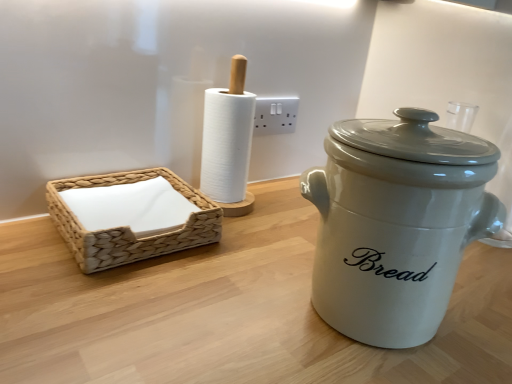
Find the location of a particular element. The width and height of the screenshot is (512, 384). white plastic electric outlet at center is located at coordinates coord(275,114).

Does point (207, 223) lie behind point (378, 184)?

Yes, it is behind point (378, 184).

Consider the image. Considering the sizes of objects woven beige basket at left and white ceramic crock pot at right in the image provided, who is shorter, woven beige basket at left or white ceramic crock pot at right?

Standing shorter between the two is woven beige basket at left.

In the scene shown: Is the position of woven beige basket at left more distant than that of white ceramic crock pot at right?

Yes, it is behind white ceramic crock pot at right.

Considering the sizes of objects woven beige basket at left and white ceramic crock pot at right in the image provided, who is smaller, woven beige basket at left or white ceramic crock pot at right?

With smaller size is woven beige basket at left.

Who is shorter, white ceramic crock pot at right or woven beige basket at left?

woven beige basket at left is shorter.

Considering the positions of objects white ceramic crock pot at right and woven beige basket at left in the image provided, who is more to the right, white ceramic crock pot at right or woven beige basket at left?

From the viewer's perspective, white ceramic crock pot at right appears more on the right side.

Is white ceramic crock pot at right located outside woven beige basket at left?

Absolutely, white ceramic crock pot at right is external to woven beige basket at left.

From a real-world perspective, which is physically below, white ceramic crock pot at right or woven beige basket at left?

In real-world perspective, woven beige basket at left is lower.

From the image's perspective, which one is positioned higher, white plastic electric outlet at center or woven beige basket at left?

white plastic electric outlet at center.

Considering the positions of objects white plastic electric outlet at center and woven beige basket at left in the image provided, who is more to the left, white plastic electric outlet at center or woven beige basket at left?

woven beige basket at left.

From a real-world perspective, is white plastic electric outlet at center physically above woven beige basket at left?

Indeed, from a real-world perspective, white plastic electric outlet at center stands above woven beige basket at left.

Would you say white plastic electric outlet at center is to the left or to the right of white ceramic crock pot at right in the picture?

Clearly, white plastic electric outlet at center is on the left of white ceramic crock pot at right in the image.

Between white plastic electric outlet at center and white ceramic crock pot at right, which one has smaller size?

white plastic electric outlet at center.

Considering the sizes of white plastic electric outlet at center and white ceramic crock pot at right in the image, is white plastic electric outlet at center taller or shorter than white ceramic crock pot at right?

white plastic electric outlet at center is shorter than white ceramic crock pot at right.

Is white ceramic crock pot at right far away from white plastic electric outlet at center?

Actually, white ceramic crock pot at right and white plastic electric outlet at center are a little close together.

Is white ceramic crock pot at right taller than white plastic electric outlet at center?

Yes.

Find the location of a particular element. crock pot that is under the white plastic electric outlet at center (from a real-world perspective) is located at coordinates (397, 223).

Considering the relative positions of white ceramic crock pot at right and white plastic electric outlet at center in the image provided, is white ceramic crock pot at right to the right of white plastic electric outlet at center from the viewer's perspective?

Yes, white ceramic crock pot at right is to the right of white plastic electric outlet at center.

From their relative heights in the image, would you say woven beige basket at left is taller or shorter than white plastic electric outlet at center?

Clearly, woven beige basket at left is shorter compared to white plastic electric outlet at center.

Would you consider woven beige basket at left to be distant from white plastic electric outlet at center?

woven beige basket at left is near white plastic electric outlet at center, not far away.

Is point (66, 188) closer or farther from the camera than point (270, 105)?

Clearly, point (66, 188) is closer to the camera than point (270, 105).

At what (x,y) coordinates should I click in order to perform the action: click on basket above the white ceramic crock pot at right (from the image's perspective). Please return your answer as a coordinate pair (x, y). The width and height of the screenshot is (512, 384). Looking at the image, I should click on click(130, 216).

Identify the location of basket to the left of white ceramic crock pot at right. (130, 216).

Looking at the image, which one is located further to white plastic electric outlet at center, white ceramic crock pot at right or woven beige basket at left?

white ceramic crock pot at right.

Considering their positions, is woven beige basket at left positioned closer to white plastic electric outlet at center than white ceramic crock pot at right?

woven beige basket at left lies closer to white plastic electric outlet at center than the other object.

When comparing their distances from white ceramic crock pot at right, does white plastic electric outlet at center or woven beige basket at left seem closer?

woven beige basket at left is positioned closer to the anchor white ceramic crock pot at right.

From the image, which object appears to be farther from woven beige basket at left, white ceramic crock pot at right or white plastic electric outlet at center?

white plastic electric outlet at center.

Estimate the real-world distances between objects in this image. Which object is closer to woven beige basket at left, white plastic electric outlet at center or white ceramic crock pot at right?

white ceramic crock pot at right is positioned closer to the anchor woven beige basket at left.

When comparing their distances from white ceramic crock pot at right, does woven beige basket at left or white plastic electric outlet at center seem further?

Among the two, white plastic electric outlet at center is located further to white ceramic crock pot at right.

You are a GUI agent. You are given a task and a screenshot of the screen. Output one action in this format:
    pyautogui.click(x=<x>, y=<y>)
    Task: Click on the basket between white ceramic crock pot at right and white plastic electric outlet at center from front to back
    Image resolution: width=512 pixels, height=384 pixels.
    Given the screenshot: What is the action you would take?
    pos(130,216)